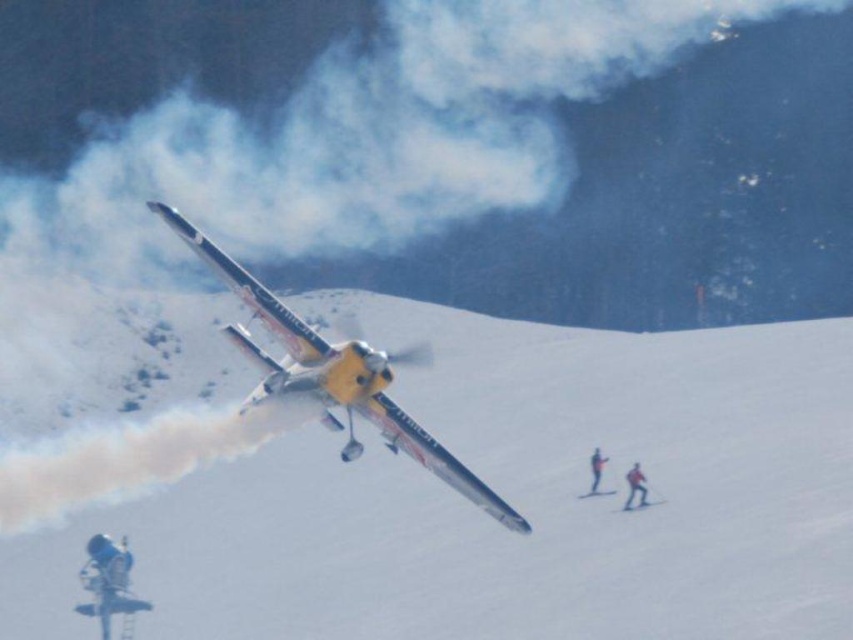
Is point (451, 472) farther from viewer compared to point (598, 472)?

No, it is not.

Measure the distance between yellow matte airplane at center and yellow fabric skier at lower right.

yellow matte airplane at center and yellow fabric skier at lower right are 57.24 feet apart from each other.

Find the location of a particular element. The width and height of the screenshot is (853, 640). yellow matte airplane at center is located at coordinates (337, 376).

You are a GUI agent. You are given a task and a screenshot of the screen. Output one action in this format:
    pyautogui.click(x=<x>, y=<y>)
    Task: Click on the yellow matte airplane at center
    Image resolution: width=853 pixels, height=640 pixels.
    Given the screenshot: What is the action you would take?
    pyautogui.click(x=337, y=376)

Between yellow matte airplane at center and red fabric skier at lower right, which one is positioned higher?

Positioned higher is yellow matte airplane at center.

Does yellow matte airplane at center appear on the left side of red fabric skier at lower right?

Indeed, yellow matte airplane at center is positioned on the left side of red fabric skier at lower right.

Is point (276, 390) positioned in front of point (646, 492)?

Yes, point (276, 390) is closer to viewer.

Find the location of `yellow matte airplane at center`. yellow matte airplane at center is located at coordinates (337, 376).

Is red fabric skier at lower right thinner than yellow fabric skier at lower right?

Yes.

Which is in front, point (633, 472) or point (593, 477)?

Point (633, 472) is in front.

Locate an element on the screen. This screenshot has width=853, height=640. red fabric skier at lower right is located at coordinates (635, 486).

Locate an element on the screen. This screenshot has height=640, width=853. red fabric skier at lower right is located at coordinates (635, 486).